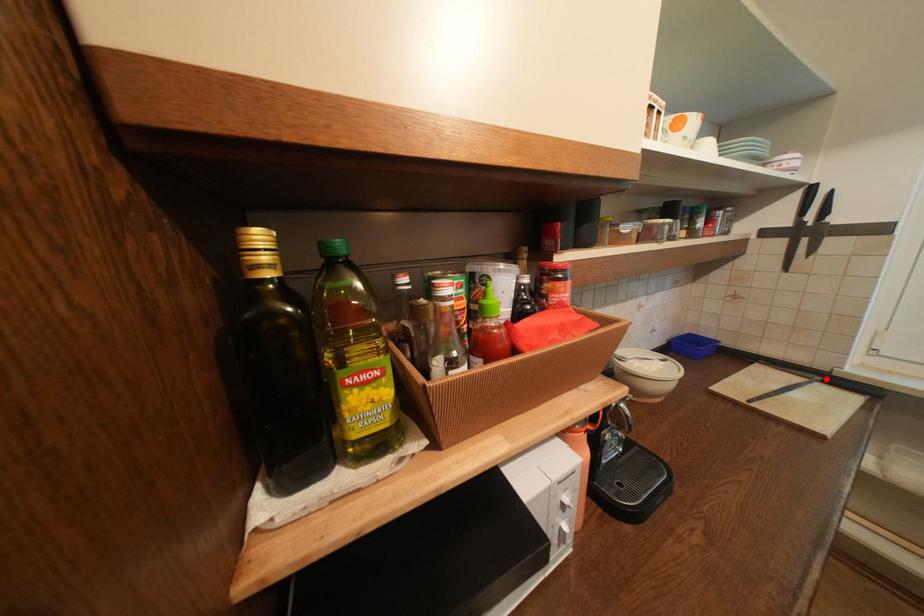
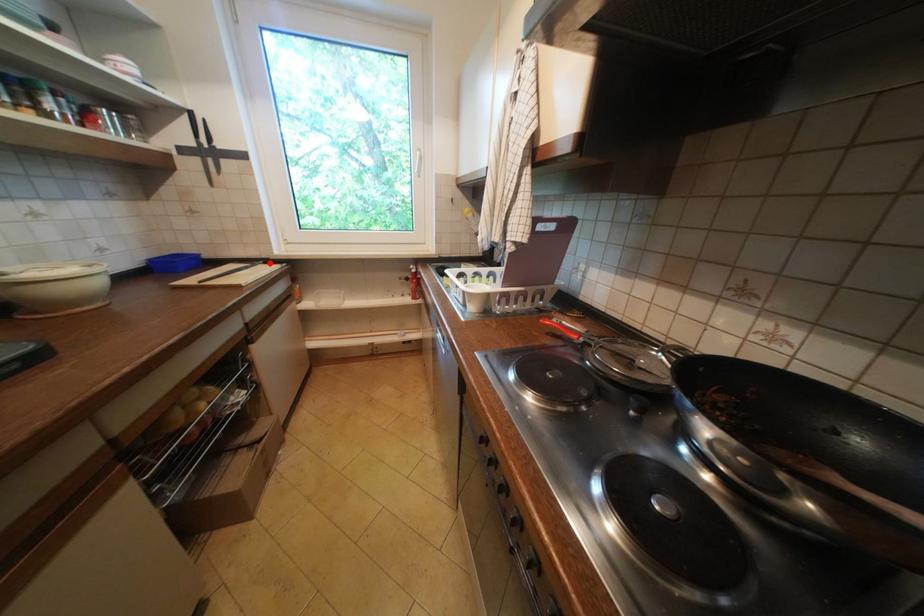
I am providing you with two images of the same scene from different viewpoints. A red point is marked on the first image and another point is marked on the second image. Is the marked point in image1 the same physical position as the marked point in image2?

Yes